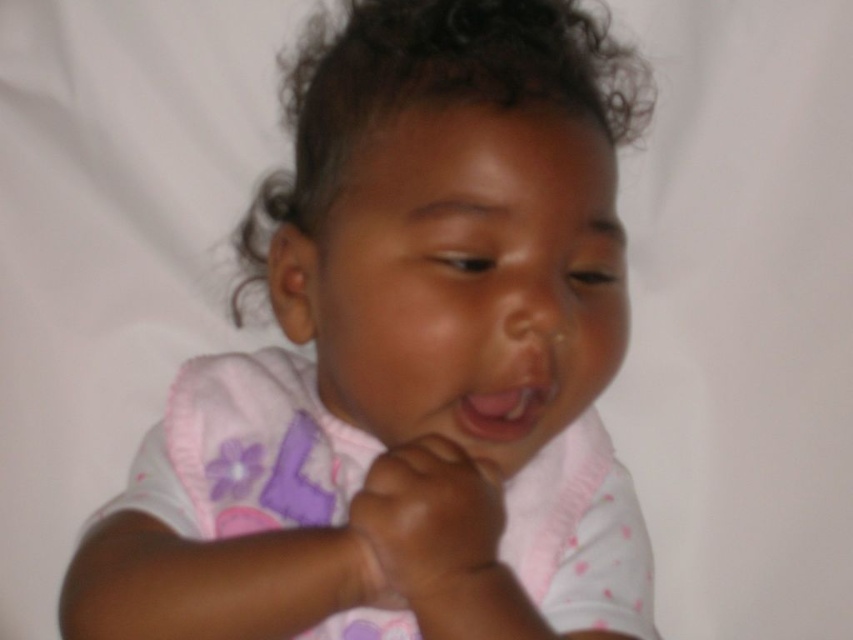
Who is positioned more to the right, pink fabric toddler at center or smooth skin hand at center?

Positioned to the right is smooth skin hand at center.

Measure the distance between pink fabric toddler at center and camera.

21.89 inches

Find the location of `pink fabric toddler at center`. pink fabric toddler at center is located at coordinates (405, 358).

Is smooth skin hand at center smaller than pink matte lips at center?

Incorrect, smooth skin hand at center is not smaller in size than pink matte lips at center.

Consider the image. Between smooth skin hand at center and pink matte lips at center, which one has less height?

pink matte lips at center

Where is `smooth skin hand at center`? The image size is (853, 640). smooth skin hand at center is located at coordinates (434, 529).

Is pink fabric toddler at center smaller than pink matte lips at center?

No.

The image size is (853, 640). I want to click on pink fabric toddler at center, so (405, 358).